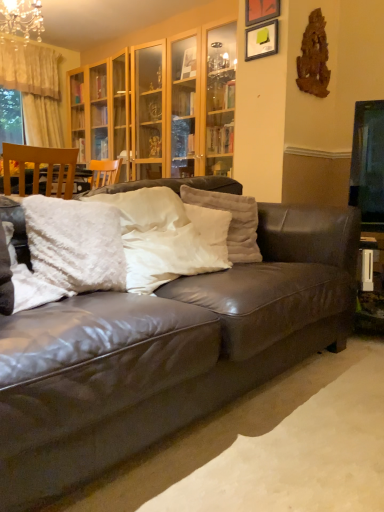
Question: Which direction should I rotate to face white fluffy pillow at center, the third pillow positioned from the right, — up or down?

Choices:
 (A) down
 (B) up

Answer: (B)

Question: From the image's perspective, is matte wooden picture frame at upper center, placed as the 2th picture frame when sorted from bottom to top, on top of white fluffy pillow at center, the 2th pillow when ordered from left to right?

Choices:
 (A) no
 (B) yes

Answer: (B)

Question: Is matte wooden picture frame at upper center, which appears as the first picture frame when viewed from the top, positioned behind white fluffy pillow at center, the third pillow positioned from the right?

Choices:
 (A) yes
 (B) no

Answer: (A)

Question: From a real-world perspective, is matte wooden picture frame at upper center, which appears as the first picture frame when viewed from the top, physically above white fluffy pillow at center, the 2th pillow when ordered from left to right?

Choices:
 (A) yes
 (B) no

Answer: (A)

Question: Could you tell me if matte wooden picture frame at upper center, placed as the 2th picture frame when sorted from bottom to top, is facing white fluffy pillow at center, the third pillow positioned from the right?

Choices:
 (A) yes
 (B) no

Answer: (B)

Question: From the image's perspective, is matte wooden picture frame at upper center, which appears as the first picture frame when viewed from the top, beneath white fluffy pillow at center, the third pillow positioned from the right?

Choices:
 (A) yes
 (B) no

Answer: (B)

Question: From a real-world perspective, is matte wooden picture frame at upper center, which appears as the first picture frame when viewed from the top, positioned under white fluffy pillow at center, the third pillow positioned from the right, based on gravity?

Choices:
 (A) no
 (B) yes

Answer: (A)

Question: Can you confirm if white fluffy pillow at center, the 2th pillow when ordered from left to right, is bigger than matte wooden picture frame at upper center, placed as the 2th picture frame when sorted from bottom to top?

Choices:
 (A) no
 (B) yes

Answer: (B)

Question: Is white fluffy pillow at center, the third pillow positioned from the right, not close to matte wooden picture frame at upper center, which appears as the first picture frame when viewed from the top?

Choices:
 (A) yes
 (B) no

Answer: (A)

Question: Is white fluffy pillow at center, the third pillow positioned from the right, oriented towards matte wooden picture frame at upper center, which appears as the first picture frame when viewed from the top?

Choices:
 (A) yes
 (B) no

Answer: (B)

Question: Is white fluffy pillow at center, the 2th pillow when ordered from left to right, in front of matte wooden picture frame at upper center, which appears as the first picture frame when viewed from the top?

Choices:
 (A) yes
 (B) no

Answer: (A)

Question: From a real-world perspective, is white fluffy pillow at center, the 2th pillow when ordered from left to right, positioned over matte wooden picture frame at upper center, which appears as the first picture frame when viewed from the top, based on gravity?

Choices:
 (A) no
 (B) yes

Answer: (A)

Question: Can you see white fluffy pillow at center, the third pillow positioned from the right, touching matte wooden picture frame at upper center, placed as the 2th picture frame when sorted from bottom to top?

Choices:
 (A) no
 (B) yes

Answer: (A)

Question: From a real-world perspective, is white fluffy pillow at center, which is counted as the first pillow, starting from the right, located beneath crystal glass chandelier at upper left?

Choices:
 (A) no
 (B) yes

Answer: (B)